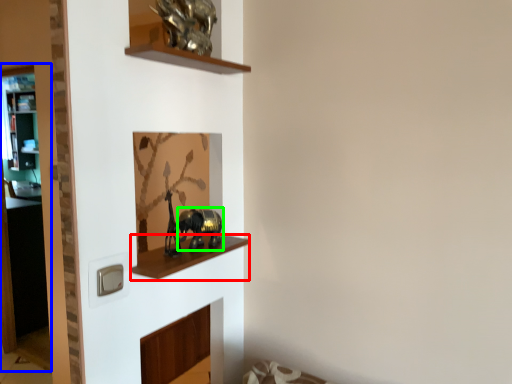
Question: Based on their relative distances, which object is farther from cabinet (highlighted by a red box)? Choose from glass door (highlighted by a blue box) and animal (highlighted by a green box).

Choices:
 (A) glass door
 (B) animal

Answer: (A)